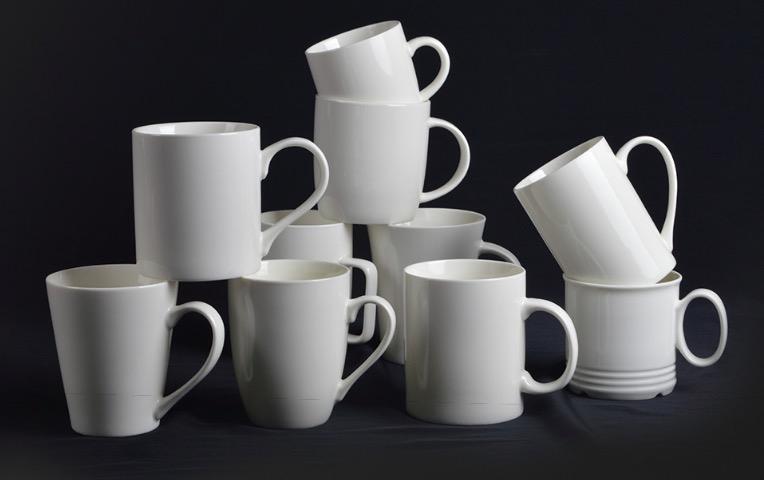
Identify the location of cups without lids. The height and width of the screenshot is (480, 764). (465, 343), (452, 228), (636, 332), (614, 215), (382, 57), (380, 154), (312, 351), (329, 227), (214, 203), (130, 332).